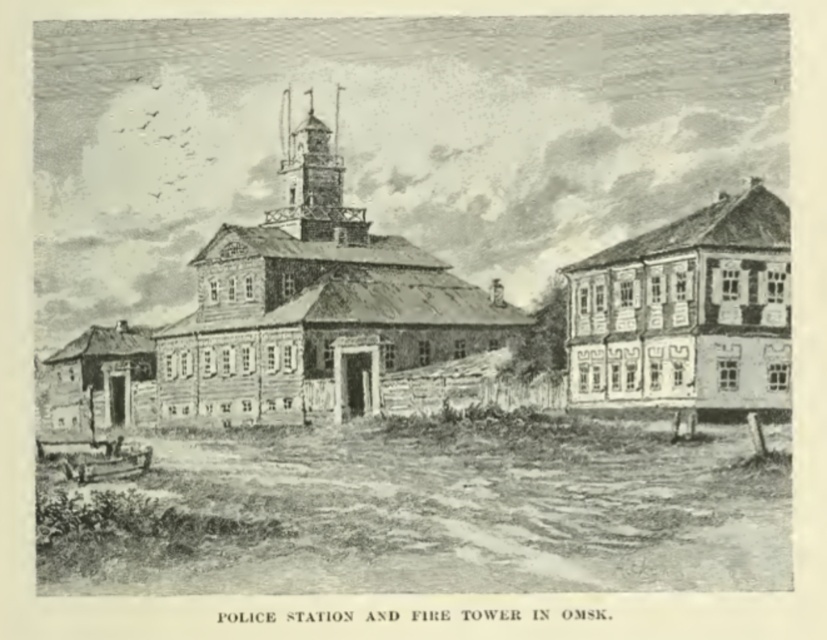
You are a visitor arriving at the police station and need to locate the fire tower. According to the illustration, where is the wooden tower at center in relation to the wooden house at right?

The wooden tower at center is positioned over the wooden house at right, meaning it is directly above it in the image.

You are standing in front of the police station and need to locate the fire tower. According to the illustration, where is the wooden tower at center relative to the wooden house at right?

The wooden tower at center is to the left of the wooden house at right.